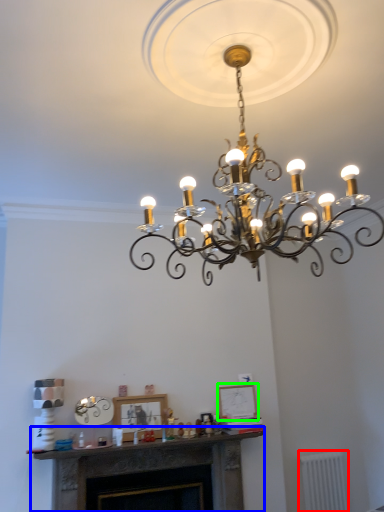
Question: Estimate the real-world distances between objects in this image. Which object is closer to radiator (highlighted by a red box), fireplace (highlighted by a blue box) or picture frame (highlighted by a green box)?

Choices:
 (A) fireplace
 (B) picture frame

Answer: (B)